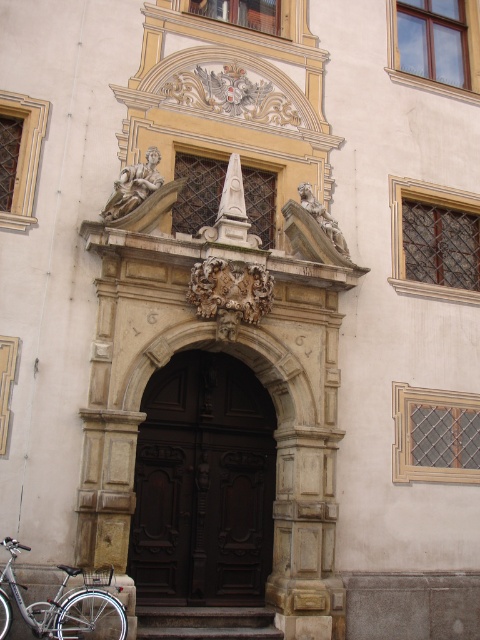
Between dark wood door at center and brown wooden stairs at center, which one appears on the left side from the viewer's perspective?

dark wood door at center

Is dark wood door at center taller than brown wooden stairs at center?

In fact, dark wood door at center may be shorter than brown wooden stairs at center.

At what (x,y) coordinates should I click in order to perform the action: click on dark wood door at center. Please return your answer as a coordinate pair (x, y). The width and height of the screenshot is (480, 640). Looking at the image, I should click on (203, 484).

Which is more to the left, silver metallic bicycle at lower left or brown wooden stairs at center?

Positioned to the left is silver metallic bicycle at lower left.

Is silver metallic bicycle at lower left positioned in front of brown wooden stairs at center?

Yes.

Is point (80, 616) positioned before point (187, 630)?

Yes, it is.

Where is `silver metallic bicycle at lower left`? silver metallic bicycle at lower left is located at coordinates (62, 608).

Looking at this image, is dark wood door at center wider than silver metallic bicycle at lower left?

Incorrect, dark wood door at center's width does not surpass silver metallic bicycle at lower left's.

Based on the photo, is dark wood door at center further to the viewer compared to silver metallic bicycle at lower left?

Yes.

Which is in front, point (193, 512) or point (90, 589)?

Point (90, 589)

Find the location of a particular element. The width and height of the screenshot is (480, 640). dark wood door at center is located at coordinates (203, 484).